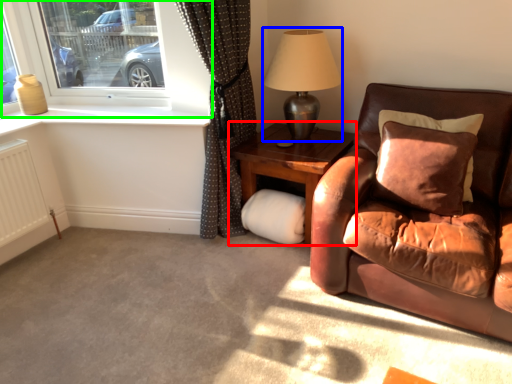
Question: Considering the real-world distances, which object is closest to table (highlighted by a red box)? table lamp (highlighted by a blue box) or window (highlighted by a green box).

Choices:
 (A) table lamp
 (B) window

Answer: (A)